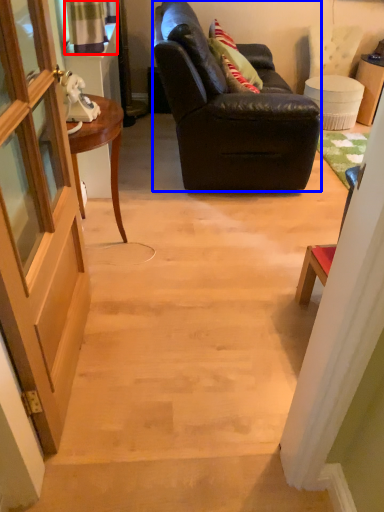
Question: Which point is further to the camera, curtain (highlighted by a red box) or studio couch (highlighted by a blue box)?

Choices:
 (A) curtain
 (B) studio couch

Answer: (A)